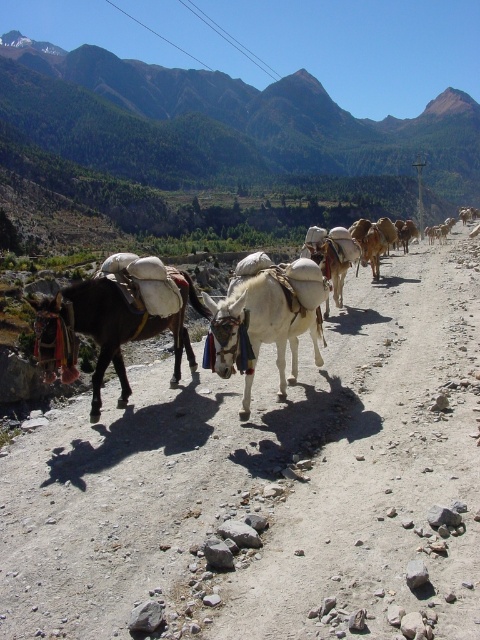
Is green grassy mountain at upper center positioned behind dark brown leather mule at left?

Yes, green grassy mountain at upper center is further from the viewer.

Looking at this image, is green grassy mountain at upper center smaller than dark brown leather mule at left?

Incorrect, green grassy mountain at upper center is not smaller in size than dark brown leather mule at left.

Locate an element on the screen. The width and height of the screenshot is (480, 640). green grassy mountain at upper center is located at coordinates (228, 125).

Can you confirm if dirt track at center is smaller than brown leather saddlebags at left?

Yes, dirt track at center is smaller than brown leather saddlebags at left.

Is point (252, 436) positioned behind point (409, 276)?

No.

Identify the location of dirt track at center. Image resolution: width=480 pixels, height=640 pixels. (264, 481).

Is brown leather saddlebags at left closer to the viewer compared to dark brown leather mule at left?

Yes, it is in front of dark brown leather mule at left.

Is brown leather saddlebags at left to the left of dark brown leather mule at left from the viewer's perspective?

In fact, brown leather saddlebags at left is to the right of dark brown leather mule at left.

This screenshot has height=640, width=480. I want to click on brown leather saddlebags at left, so click(253, 324).